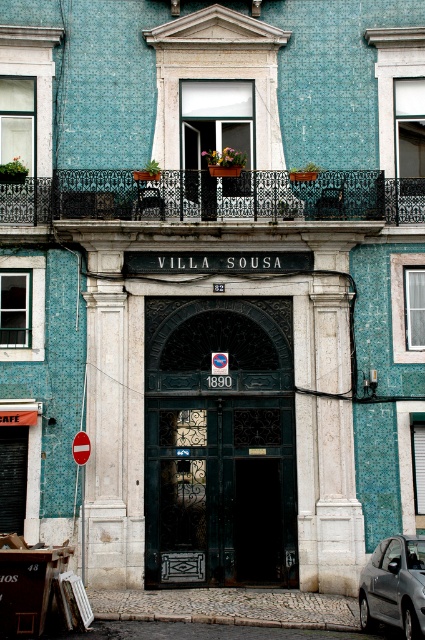
You are a delivery driver approaching the Villa Sousa building. You need to park your metallic gray car at lower right close to the dark green wrought iron door at center. Given that the door is larger than the car, can you estimate if there is enough space between the door and the car to maneuver your vehicle into a parking spot?

The dark green wrought iron door at center is bigger than the metallic gray car at lower right. Since the door is larger, there might be sufficient space between them to maneuver the car into a parking spot, but the exact distance isn

In the scene shown: You are a visitor approaching the Villa Sousa entrance. You see the dark green wrought iron door at center and the black wrought iron balcony at upper center. Which object is located higher up in the image?

The black wrought iron balcony at upper center is located higher up in the image because it is above the dark green wrought iron door at center.

You are a delivery person standing next to the metallic gray car at lower right, and you need to deliver a package to the entrance of the building. The package can only be carried by one person and requires a clear path. Can you reach the entrance without needing to go around the black wrought iron balcony at upper center?

The black wrought iron balcony at upper center is 49.00 feet away from the metallic gray car at lower right. Since the balcony is above the entrance, you can reach the entrance without needing to go around it as the balcony is elevated and does not block the path.